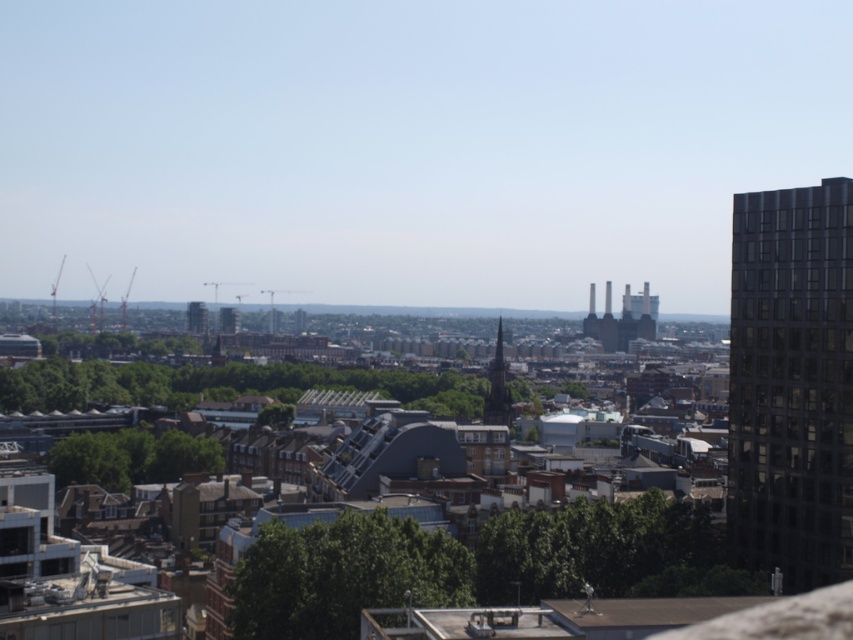
Which of these two, dark gray stone spire at center or matte gray building at center, stands taller?

dark gray stone spire at center

Does point (503, 371) lie in front of point (218, 316)?

Yes, point (503, 371) is closer to viewer.

Between point (502, 385) and point (227, 326), which one is positioned behind?

The point (227, 326) is more distant.

Find the location of a particular element. The height and width of the screenshot is (640, 853). dark gray stone spire at center is located at coordinates (497, 387).

Is point (788, 486) positioned behind point (190, 321)?

No, it is in front of (190, 321).

Between point (796, 529) and point (199, 324), which one is positioned behind?

The point (199, 324) is more distant.

Locate an element on the screen. dark glass building at right is located at coordinates (791, 381).

Consider the image. Between dark glass building at right and matte gray building at center, which one is positioned lower?

dark glass building at right is lower down.

The height and width of the screenshot is (640, 853). Identify the location of dark glass building at right. (791, 381).

Who is more distant from viewer, (x=809, y=397) or (x=231, y=308)?

Point (x=231, y=308)

Locate an element on the screen. dark glass building at right is located at coordinates (791, 381).